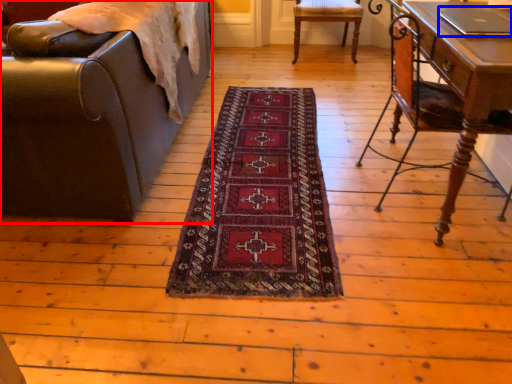
Question: Among these objects, which one is farthest to the camera, chair (highlighted by a red box) or laptop (highlighted by a blue box)?

Choices:
 (A) chair
 (B) laptop

Answer: (B)